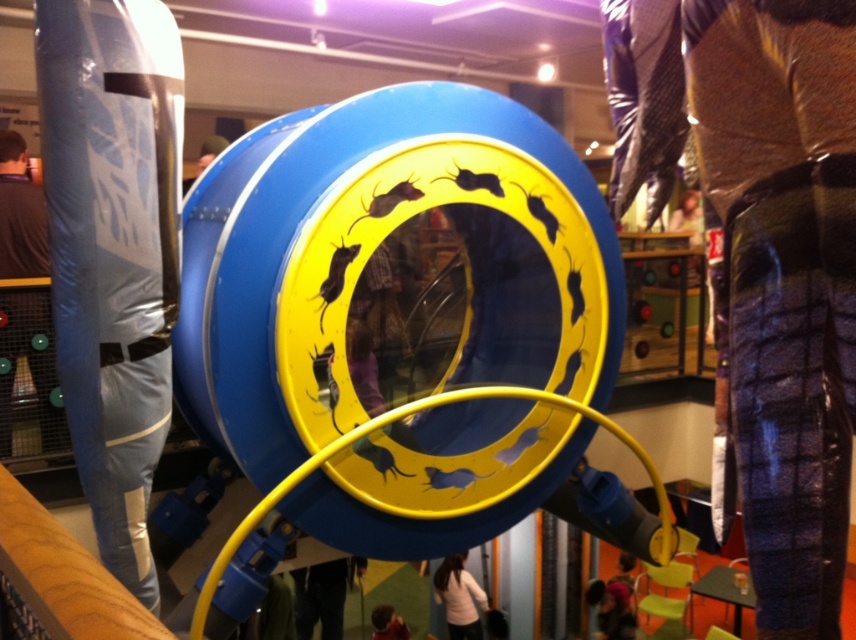
Which is below, brown fuzzy sweater at left or denim pants at lower center?

denim pants at lower center is lower down.

Find the location of a particular element. The image size is (856, 640). brown fuzzy sweater at left is located at coordinates (21, 214).

Is denim pants at lower center below white sweater at center?

No.

Does point (321, 595) come behind point (462, 634)?

No, it is not.

Is point (296, 582) less distant than point (453, 566)?

Yes, point (296, 582) is closer to viewer.

Locate an element on the screen. denim pants at lower center is located at coordinates (324, 595).

Does plaid fabric pants at right have a lesser width compared to denim pants at lower center?

Indeed, plaid fabric pants at right has a lesser width compared to denim pants at lower center.

Between point (780, 227) and point (364, 560), which one is positioned in front?

Positioned in front is point (780, 227).

Is point (709, 74) positioned after point (333, 566)?

No.

This screenshot has height=640, width=856. I want to click on plaid fabric pants at right, so click(x=762, y=256).